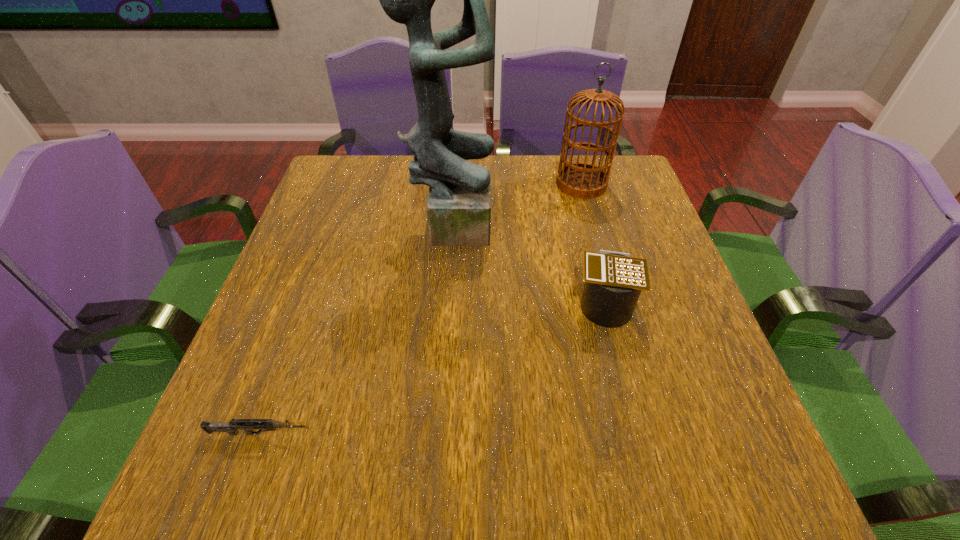
Locate an element on the screen. This screenshot has width=960, height=540. blank region between the leftmost object and the birdcage is located at coordinates (420, 309).

Locate an element on the screen. The height and width of the screenshot is (540, 960). unoccupied area between the shortest object and the second object from left to right is located at coordinates (356, 328).

Identify the location of blank region between the leftmost object and the birdcage. The width and height of the screenshot is (960, 540). (420, 309).

Locate an element on the screen. The width and height of the screenshot is (960, 540). the second closest object relative to the sculpture is located at coordinates click(x=613, y=281).

Find the location of a particular element. This screenshot has height=540, width=960. object that ranks as the second closest to the second nearest object is located at coordinates (582, 180).

The height and width of the screenshot is (540, 960). Identify the location of vacant area that satisfies the following two spatial constraints: 1. on the face of the tallest object; 2. on the back side of the second nearest object. (446, 301).

Identify the location of free space in the image that satisfies the following two spatial constraints: 1. on the front side of the third shortest object; 2. on the face of the tallest object. This screenshot has height=540, width=960. (591, 221).

This screenshot has height=540, width=960. Identify the location of vacant space that satisfies the following two spatial constraints: 1. on the back side of the second nearest object; 2. on the face of the third object from right to left. (583, 221).